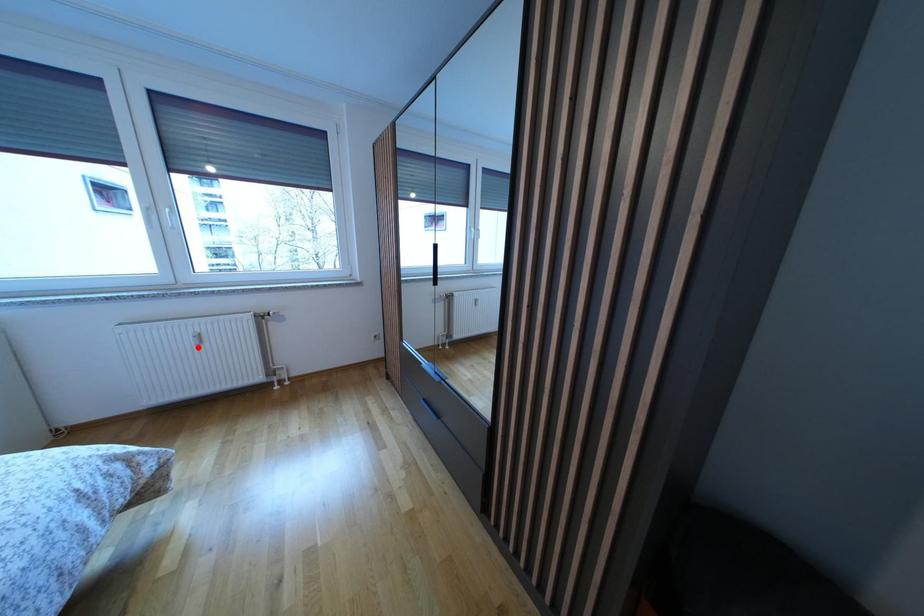
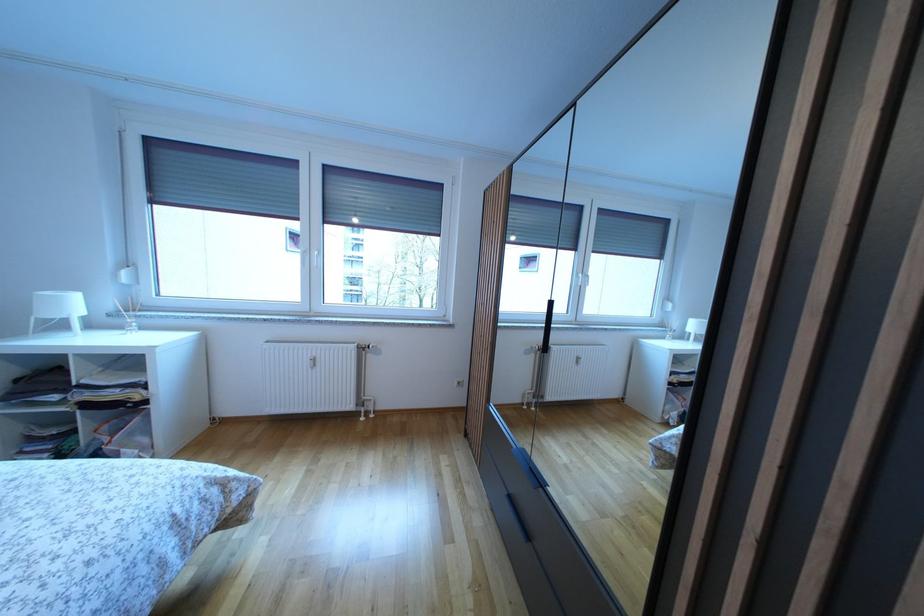
Find the pixel in the second image that matches the highlighted location in the first image.

(314, 370)